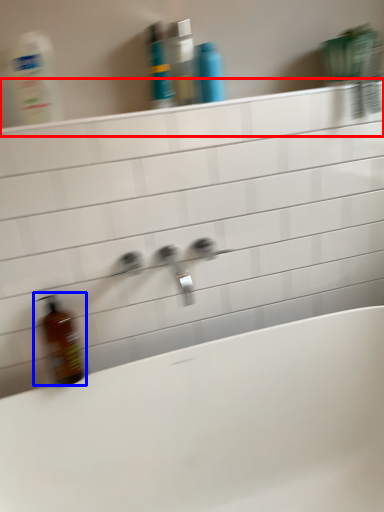
Question: Which of the following is the farthest to the observer, ledge (highlighted by a red box) or bottle (highlighted by a blue box)?

Choices:
 (A) ledge
 (B) bottle

Answer: (B)